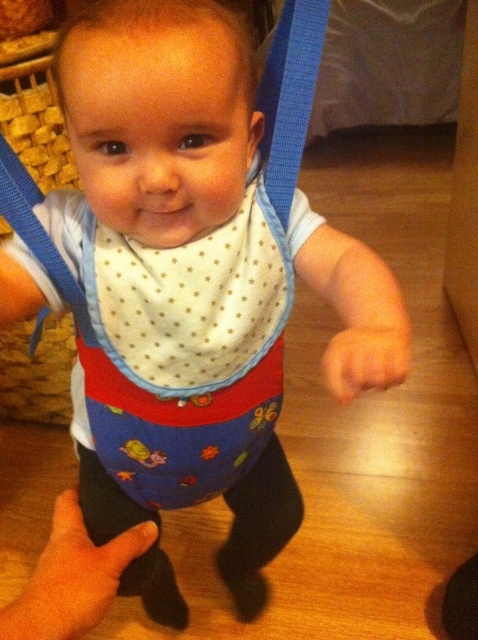
You are a photographer taking a picture of the baby. The camera lens is 24 inches away from the baby. Can you focus on the white dotted fabric bib at center without adjusting the camera distance?

The white dotted fabric bib at center is 23.84 inches away from viewer. Since the camera lens is 24 inches away, the distance is just slightly farther than the bib, so the camera might need a slight adjustment to focus properly.

You are a photographer taking a closeup shot of the baby. You notice the white dotted fabric bib at center and the blue fabric strap at upper center. Which object is closer to your camera lens?

The white dotted fabric bib at center is closer to the camera lens because it is further to the viewer than the blue fabric strap at upper center.

Looking at this image, you are a photographer taking a picture of the baby. You need to ensure that the white dotted fabric bib at center and the blue fabric strap at upper center are both visible in the frame. Given their sizes, which object should you focus on to make sure both are in the frame?

The white dotted fabric bib at center is taller than the blue fabric strap at upper center, so focusing on the white dotted fabric bib at center will ensure both objects are visible since it is larger and positioned lower.